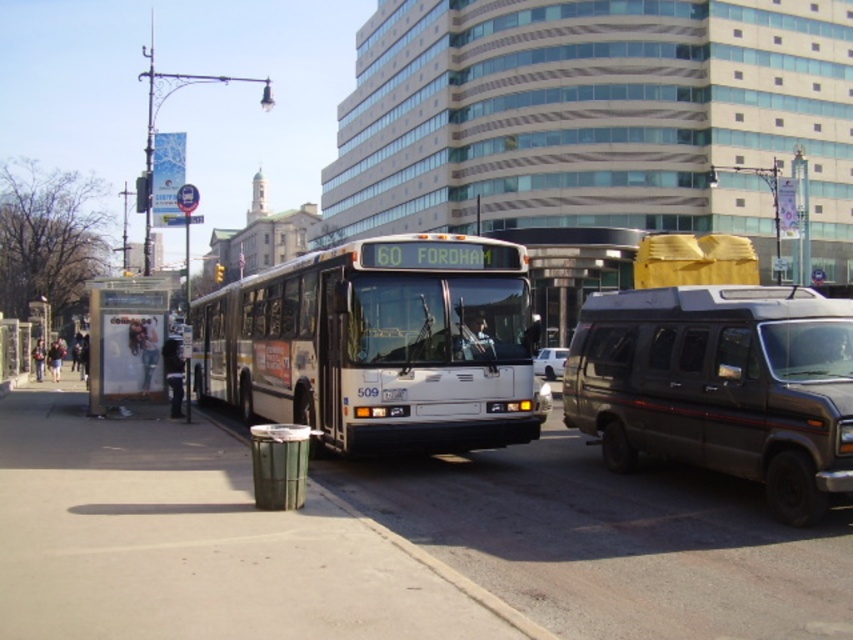
From the picture: You are a delivery person standing on the smooth concrete pavement at lower center, and you need to place a package in the back of the dark gray matte van at right. The van requires a minimum of 5 meters of clearance to open its side doors safely. Can you safely open the van doors from your current position?

The smooth concrete pavement at lower center is 5.55 meters from the dark gray matte van at right. Since the required clearance is 5 meters, the distance is sufficient, so you can safely open the van doors from your current position.

You are a delivery person who needs to place a small package on the smooth concrete pavement at lower center. However, there is a denim jacket at lower left nearby. Which object can you place the package on without it being obstructed?

The smooth concrete pavement at lower center is smaller than the denim jacket at lower left, so placing the package on the denim jacket at lower left would provide more space and avoid obstruction.

You are standing on the sidewalk and want to place a small potted plant between the smooth concrete pavement at lower center and the denim jacket at lower left. Which object should the plant be placed closer to if you want it to be nearer to the viewer?

The plant should be placed closer to the smooth concrete pavement at lower center because it is already closer to the viewer than the denim jacket at lower left.